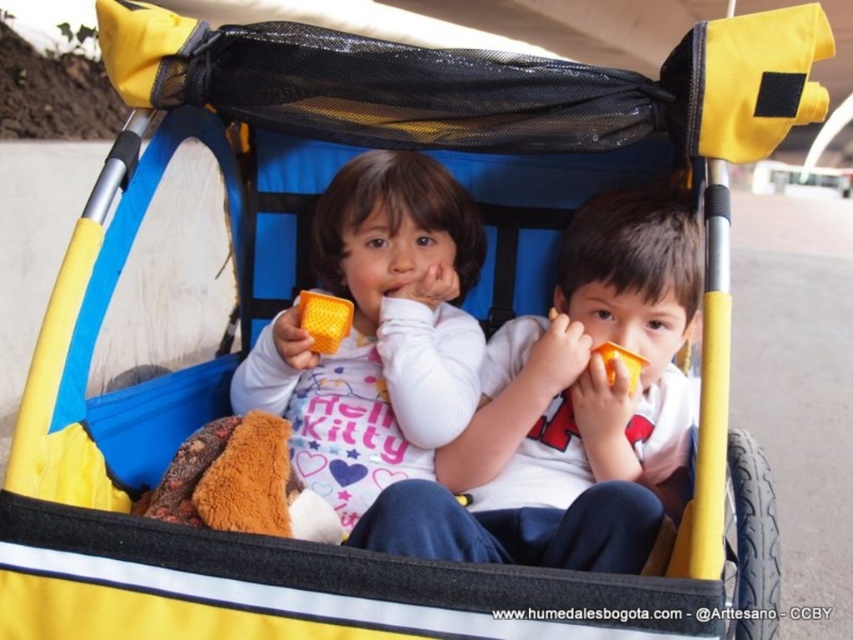
Question: Does orange plastic cup at center appear under matte orange cup at center?

Choices:
 (A) yes
 (B) no

Answer: (A)

Question: Is orange plastic cup at center positioned behind matte orange cup at center?

Choices:
 (A) yes
 (B) no

Answer: (B)

Question: Can you confirm if orange plastic cup at center is positioned below matte orange cup at center?

Choices:
 (A) yes
 (B) no

Answer: (A)

Question: Which object is closer to the camera taking this photo?

Choices:
 (A) matte orange cup at center
 (B) orange plastic cup at center

Answer: (B)